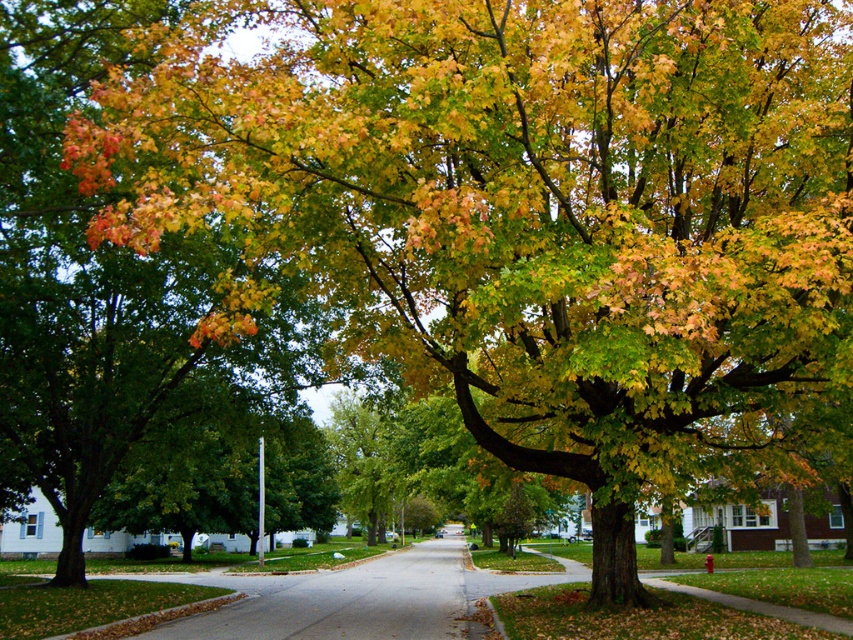
Question: Does shiny green leaves at center have a greater width compared to gray asphalt road at center?

Choices:
 (A) no
 (B) yes

Answer: (B)

Question: Which of the following is the farthest from the observer?

Choices:
 (A) (447, 586)
 (B) (299, 317)

Answer: (A)

Question: Is shiny green leaves at center below gray asphalt road at center?

Choices:
 (A) no
 (B) yes

Answer: (A)

Question: Which of the following is the farthest from the observer?

Choices:
 (A) shiny green leaves at center
 (B) gray asphalt road at center

Answer: (B)

Question: Does shiny green leaves at center have a smaller size compared to gray asphalt road at center?

Choices:
 (A) yes
 (B) no

Answer: (A)